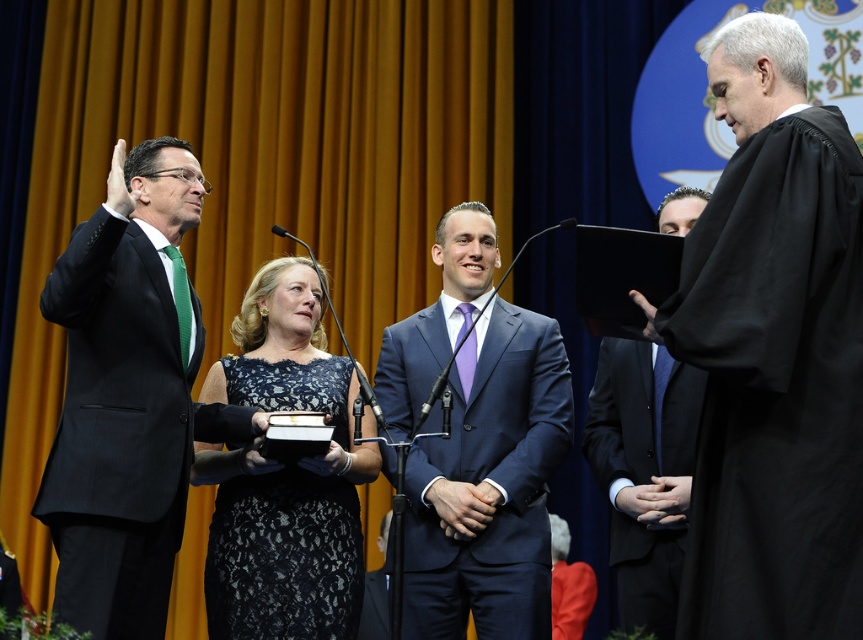
Where is the black robe at right located in the image?

The black robe at right is located at point (773, 355) in the image.

You are an event planner organizing a similar ceremony. You need to place a narrow decorative banner between the black robe at right and the lace dress at center. Which side should you place it on to ensure it fits properly?

The black robe at right is thinner than the lace dress at center, so placing the narrow decorative banner on the side of the black robe at right would ensure it fits properly since it requires less space.